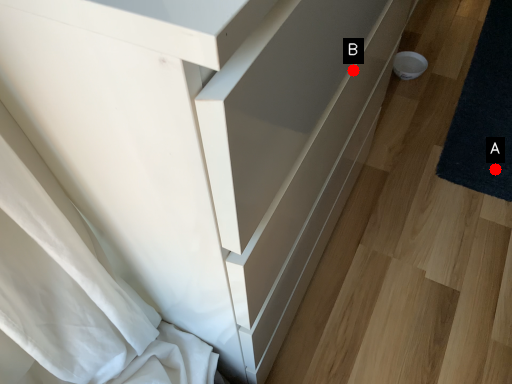
Question: Two points are circled on the image, labeled by A and B beside each circle. Which point appears closest to the camera in this image?

Choices:
 (A) A is closer
 (B) B is closer

Answer: (B)